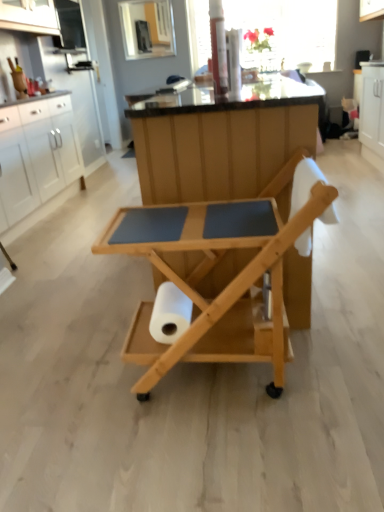
Question: Can you confirm if white matte cabinet at left is wider than transparent glass window screen at upper center?

Choices:
 (A) no
 (B) yes

Answer: (B)

Question: Is white matte cabinet at left turned away from transparent glass window screen at upper center?

Choices:
 (A) no
 (B) yes

Answer: (A)

Question: From the image's perspective, is white matte cabinet at left on top of transparent glass window screen at upper center?

Choices:
 (A) no
 (B) yes

Answer: (A)

Question: From the image's perspective, is white matte cabinet at left under transparent glass window screen at upper center?

Choices:
 (A) yes
 (B) no

Answer: (A)

Question: Could you tell me if white matte cabinet at left is facing transparent glass window screen at upper center?

Choices:
 (A) yes
 (B) no

Answer: (B)

Question: Is white matte cabinet at left taller than transparent glass window screen at upper center?

Choices:
 (A) yes
 (B) no

Answer: (B)

Question: From a real-world perspective, is natural wood rolling cart at center positioned under white matte paper towel at center based on gravity?

Choices:
 (A) no
 (B) yes

Answer: (A)

Question: Does natural wood rolling cart at center have a greater height compared to white matte paper towel at center?

Choices:
 (A) no
 (B) yes

Answer: (B)

Question: Is natural wood rolling cart at center not within white matte paper towel at center?

Choices:
 (A) no
 (B) yes

Answer: (B)

Question: Does natural wood rolling cart at center come behind white matte paper towel at center?

Choices:
 (A) yes
 (B) no

Answer: (B)

Question: Can white matte paper towel at center be found inside natural wood rolling cart at center?

Choices:
 (A) no
 (B) yes

Answer: (B)

Question: Can you confirm if natural wood rolling cart at center is wider than white matte paper towel at center?

Choices:
 (A) no
 (B) yes

Answer: (B)

Question: Considering the relative sizes of white matte paper towel at center and transparent glass window screen at upper center in the image provided, is white matte paper towel at center bigger than transparent glass window screen at upper center?

Choices:
 (A) no
 (B) yes

Answer: (A)